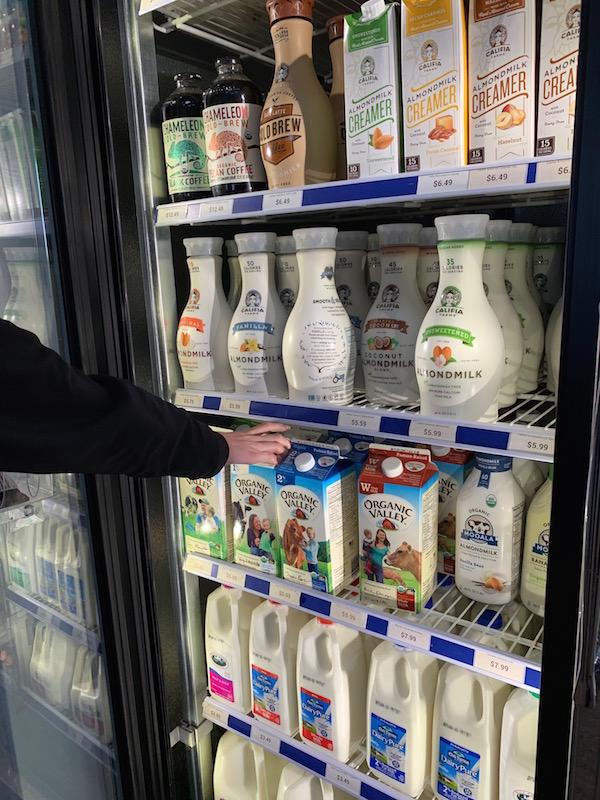
At what (x,y) coordinates should I click in order to perform the action: click on creamer. Please return your answer as a coordinate pair (x, y). The image size is (600, 800). Looking at the image, I should click on (385, 134), (444, 122), (499, 122), (543, 122).